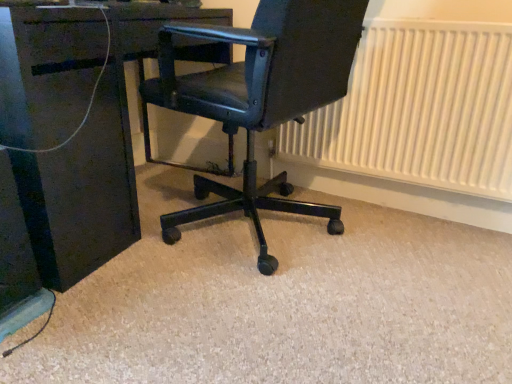
Question: Considering the relative sizes of matte black desk at center and white textured radiator at right in the image provided, is matte black desk at center shorter than white textured radiator at right?

Choices:
 (A) yes
 (B) no

Answer: (B)

Question: Is matte black desk at center outside white textured radiator at right?

Choices:
 (A) yes
 (B) no

Answer: (A)

Question: Is matte black desk at center with white textured radiator at right?

Choices:
 (A) yes
 (B) no

Answer: (B)

Question: From the image's perspective, would you say matte black desk at center is positioned over white textured radiator at right?

Choices:
 (A) yes
 (B) no

Answer: (A)

Question: From a real-world perspective, does matte black desk at center stand above white textured radiator at right?

Choices:
 (A) no
 (B) yes

Answer: (B)

Question: Is matte black desk at center at the right side of white textured radiator at right?

Choices:
 (A) yes
 (B) no

Answer: (B)

Question: Does white textured radiator at right appear on the right side of matte black office chair at center?

Choices:
 (A) yes
 (B) no

Answer: (A)

Question: Considering the relative sizes of white textured radiator at right and matte black office chair at center in the image provided, is white textured radiator at right wider than matte black office chair at center?

Choices:
 (A) yes
 (B) no

Answer: (B)

Question: Is white textured radiator at right smaller than matte black office chair at center?

Choices:
 (A) no
 (B) yes

Answer: (B)

Question: From a real-world perspective, is white textured radiator at right over matte black office chair at center?

Choices:
 (A) yes
 (B) no

Answer: (B)

Question: From the image's perspective, is white textured radiator at right located above matte black office chair at center?

Choices:
 (A) no
 (B) yes

Answer: (B)

Question: Is white textured radiator at right shorter than matte black office chair at center?

Choices:
 (A) yes
 (B) no

Answer: (A)

Question: From the image's perspective, does matte black office chair at center appear higher than white textured radiator at right?

Choices:
 (A) no
 (B) yes

Answer: (A)